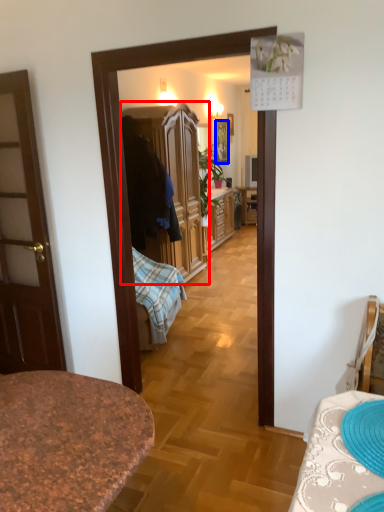
Question: Which point is closer to the camera, cabinetry (highlighted by a red box) or picture frame (highlighted by a blue box)?

Choices:
 (A) cabinetry
 (B) picture frame

Answer: (A)